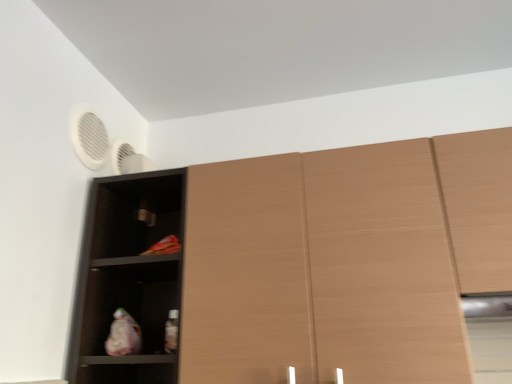
Measure the distance between point (261, 179) and camera.

The depth of point (261, 179) is 3.44 feet.

The height and width of the screenshot is (384, 512). Describe the element at coordinates (89, 137) in the screenshot. I see `white matte fan at upper left` at that location.

What do you see at coordinates (478, 206) in the screenshot?
I see `light brown wood cabinet at right` at bounding box center [478, 206].

Locate an element on the screen. wooden cupboard at center is located at coordinates (298, 264).

Considering the relative sizes of wooden cupboard at center and matte black shelf at left in the image provided, is wooden cupboard at center thinner than matte black shelf at left?

Incorrect, the width of wooden cupboard at center is not less than that of matte black shelf at left.

From a real-world perspective, is wooden cupboard at center physically below matte black shelf at left?

Yes, from a real-world perspective, wooden cupboard at center is beneath matte black shelf at left.

In the scene shown: Is wooden cupboard at center surrounding matte black shelf at left?

That's incorrect, matte black shelf at left is not inside wooden cupboard at center.

Where is `shelf below the light brown wood cabinet at right (from the image's perspective)`? This screenshot has height=384, width=512. shelf below the light brown wood cabinet at right (from the image's perspective) is located at coordinates (128, 277).

From the image's perspective, which one is positioned lower, light brown wood cabinet at right or matte black shelf at left?

From the image's view, matte black shelf at left is below.

How much distance is there between light brown wood cabinet at right and matte black shelf at left?

They are 30.98 inches apart.

Are light brown wood cabinet at right and matte black shelf at left beside each other?

No.

What's the angular difference between wooden cupboard at center and light brown wood cabinet at right's facing directions?

They differ by 1.85e-05 degrees in their facing directions.

Is wooden cupboard at center looking in the opposite direction of light brown wood cabinet at right?

No, wooden cupboard at center's orientation is not away from light brown wood cabinet at right.

Find the location of `cabinetry that is on the right side of wooden cupboard at center`. cabinetry that is on the right side of wooden cupboard at center is located at coordinates (478, 206).

Based on the photo, considering the relative sizes of wooden cupboard at center and light brown wood cabinet at right in the image provided, is wooden cupboard at center shorter than light brown wood cabinet at right?

No, wooden cupboard at center is not shorter than light brown wood cabinet at right.

This screenshot has width=512, height=384. In order to click on fan above the light brown wood cabinet at right (from a real-world perspective) in this screenshot , I will do `click(89, 137)`.

From the image's perspective, which object appears higher, light brown wood cabinet at right or white matte fan at upper left?

white matte fan at upper left appears higher in the image.

Does light brown wood cabinet at right have a lesser width compared to white matte fan at upper left?

In fact, light brown wood cabinet at right might be wider than white matte fan at upper left.

Can you tell me how much light brown wood cabinet at right and white matte fan at upper left differ in facing direction?

The angle between the facing direction of light brown wood cabinet at right and the facing direction of white matte fan at upper left is 88.5 degrees.

Considering the positions of points (94, 133) and (470, 277), is point (94, 133) farther from camera compared to point (470, 277)?

That is True.

Identify the location of cabinetry below the white matte fan at upper left (from a real-world perspective). (478, 206).

Is white matte fan at upper left further to the viewer compared to light brown wood cabinet at right?

Yes, white matte fan at upper left is further from the viewer.

From the image's perspective, does white matte fan at upper left appear higher than light brown wood cabinet at right?

Yes, from the image's perspective, white matte fan at upper left is over light brown wood cabinet at right.

From the image's perspective, is matte black shelf at left on top of light brown wood cabinet at right?

No, from the image's perspective, matte black shelf at left is not over light brown wood cabinet at right.

From a real-world perspective, who is located lower, matte black shelf at left or light brown wood cabinet at right?

From a 3D spatial view, matte black shelf at left is below.

Is matte black shelf at left taller or shorter than light brown wood cabinet at right?

Clearly, matte black shelf at left is taller compared to light brown wood cabinet at right.

From the image's perspective, is matte black shelf at left positioned above or below wooden cupboard at center?

matte black shelf at left is situated lower than wooden cupboard at center in the image.

Is matte black shelf at left located outside wooden cupboard at center?

Indeed, matte black shelf at left is completely outside wooden cupboard at center.

Which object is further away from the camera, matte black shelf at left or wooden cupboard at center?

Positioned behind is matte black shelf at left.

Considering the sizes of objects matte black shelf at left and wooden cupboard at center in the image provided, who is thinner, matte black shelf at left or wooden cupboard at center?

With smaller width is matte black shelf at left.

I want to click on cupboard located above the matte black shelf at left (from the image's perspective), so click(298, 264).

What are the coordinates of `cabinetry on the right of matte black shelf at left` in the screenshot? It's located at (478, 206).

Estimate the real-world distances between objects in this image. Which object is further from light brown wood cabinet at right, white matte fan at upper left or matte black shelf at left?

The object further to light brown wood cabinet at right is white matte fan at upper left.

When comparing their distances from wooden cupboard at center, does light brown wood cabinet at right or matte black shelf at left seem closer?

matte black shelf at left is closer to wooden cupboard at center.

Which object lies further to the anchor point wooden cupboard at center, matte black shelf at left or light brown wood cabinet at right?

light brown wood cabinet at right is further to wooden cupboard at center.

When comparing their distances from matte black shelf at left, does white matte fan at upper left or wooden cupboard at center seem closer?

Among the two, wooden cupboard at center is located nearer to matte black shelf at left.

From the image, which object appears to be farther from matte black shelf at left, wooden cupboard at center or white matte fan at upper left?

The object further to matte black shelf at left is white matte fan at upper left.

Based on their spatial positions, is wooden cupboard at center or light brown wood cabinet at right closer to matte black shelf at left?

wooden cupboard at center lies closer to matte black shelf at left than the other object.

Based on their spatial positions, is light brown wood cabinet at right or matte black shelf at left closer to white matte fan at upper left?

The object closer to white matte fan at upper left is matte black shelf at left.

Looking at the image, which one is located closer to white matte fan at upper left, wooden cupboard at center or matte black shelf at left?

matte black shelf at left is positioned closer to the anchor white matte fan at upper left.

I want to click on cupboard located between white matte fan at upper left and light brown wood cabinet at right in the left-right direction, so click(298, 264).

The width and height of the screenshot is (512, 384). Identify the location of shelf between white matte fan at upper left and light brown wood cabinet at right in the horizontal direction. (128, 277).

This screenshot has width=512, height=384. Find the location of `cupboard between matte black shelf at left and light brown wood cabinet at right`. cupboard between matte black shelf at left and light brown wood cabinet at right is located at coordinates (298, 264).

You are a GUI agent. You are given a task and a screenshot of the screen. Output one action in this format:
    pyautogui.click(x=<x>, y=<y>)
    Task: Click on the shelf located between white matte fan at upper left and wooden cupboard at center in the left-right direction
    
    Given the screenshot: What is the action you would take?
    pyautogui.click(x=128, y=277)